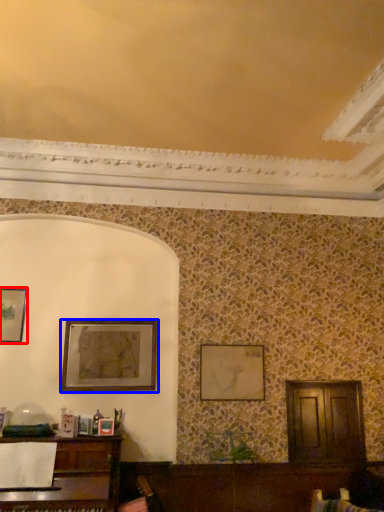
Question: Among these objects, which one is farthest to the camera, picture frame (highlighted by a red box) or picture frame (highlighted by a blue box)?

Choices:
 (A) picture frame
 (B) picture frame

Answer: (A)